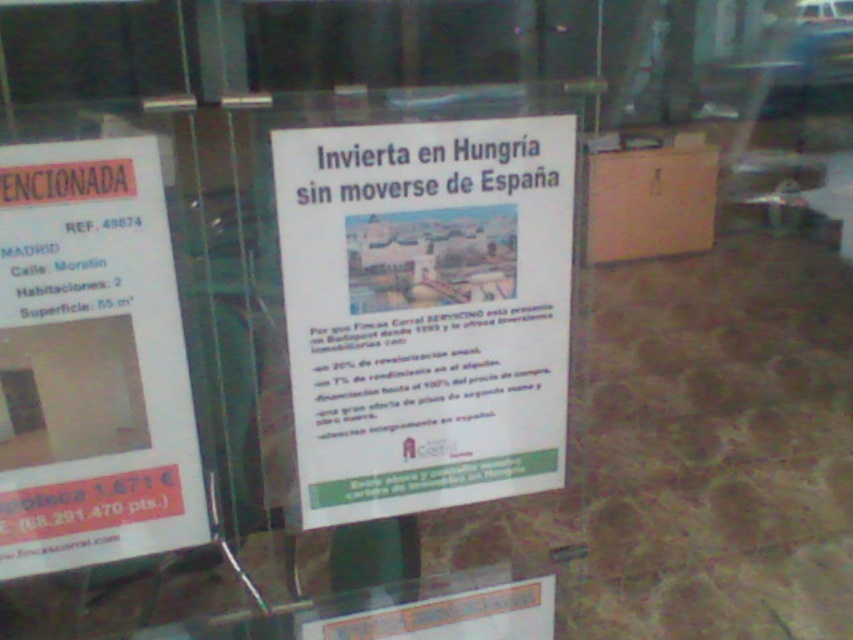
Question: Is white paper poster at center to the left of white paper poster at left from the viewer's perspective?

Choices:
 (A) no
 (B) yes

Answer: (A)

Question: Among these objects, which one is farthest from the camera?

Choices:
 (A) white paper poster at left
 (B) white paper poster at center

Answer: (B)

Question: Among these objects, which one is nearest to the camera?

Choices:
 (A) white paper poster at left
 (B) white paper poster at center

Answer: (A)

Question: Is white paper poster at center above white paper poster at left?

Choices:
 (A) no
 (B) yes

Answer: (B)

Question: Which object appears closest to the camera in this image?

Choices:
 (A) white paper poster at left
 (B) white paper poster at center

Answer: (A)

Question: Is white paper poster at center further to the viewer compared to white paper poster at left?

Choices:
 (A) no
 (B) yes

Answer: (B)